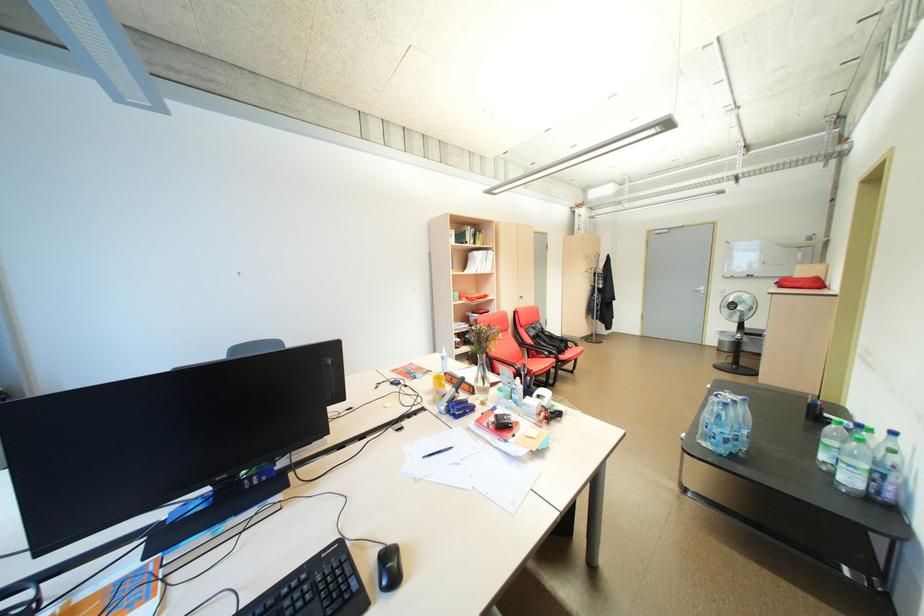
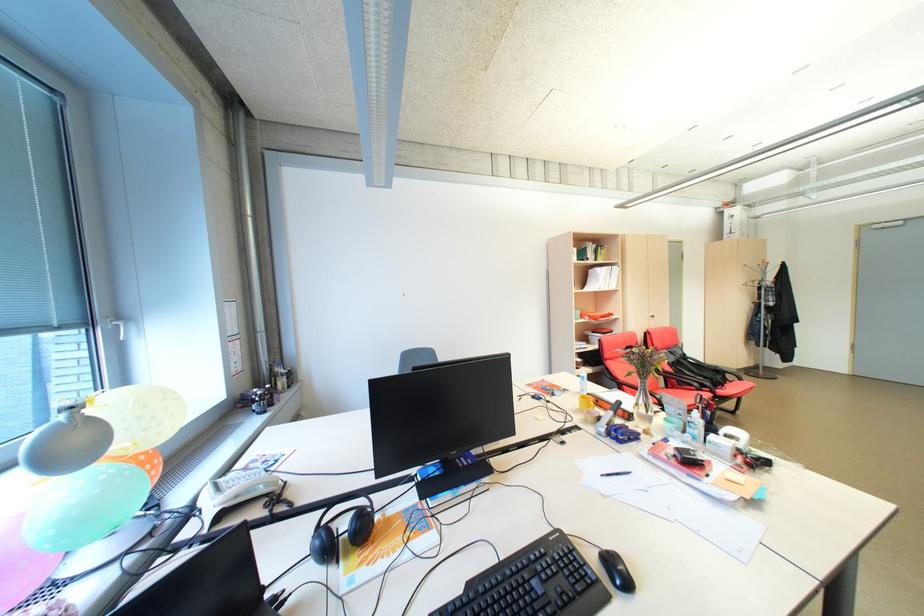
Question: I am providing you with two images of the same scene from different viewpoints. Which of the following objects are not visible in image2?

Choices:
 (A) glass vase
 (B) white telephone handset
 (C) white window handle
 (D) none of these

Answer: (D)